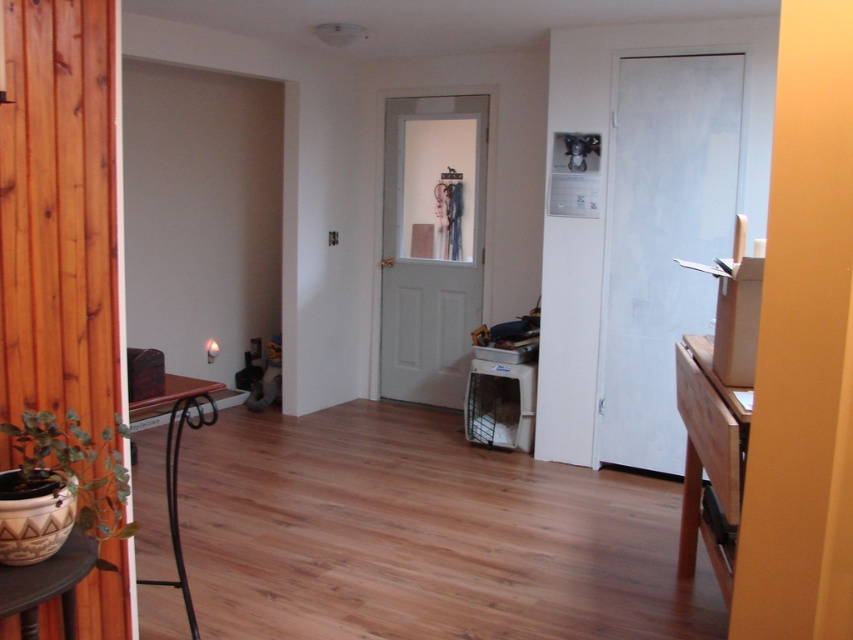
You are a delivery person carrying a package that is 1.6 meters long. You need to navigate through the hallway and place the package between the brown matte hardwood at left and the matte plastic stool at lower center. Is there enough space for the package to fit between them?

The distance between the brown matte hardwood at left and the matte plastic stool at lower center is 1.59 meters. Since the package is 1.6 meters long, it is slightly longer than the available space, so the package will not fit between them.

You are moving a rectangular box that is 12 inches wide. You need to slide it through the hallway between the light brown wood table at right and the brown matte hardwood at left. Will the box fit through the space between them?

The light brown wood table at right is thinner than the brown matte hardwood at left. Since the box is 12 inches wide, it depends on the minimum width between the two objects. However, the description only states their relative thickness, not the actual space between them. Without knowing the exact distance, we cannot confirm if the box will fit.

You are moving a large painting that is 2 meters wide. You want to place it on the wall behind the light brown wood table at right and the brown matte hardwood at left. Which object should the painting be placed in front of to ensure it doesn

The light brown wood table at right is in front of the brown matte hardwood at left, so placing the painting in front of the brown matte hardwood at left would ensure the painting is behind both objects.